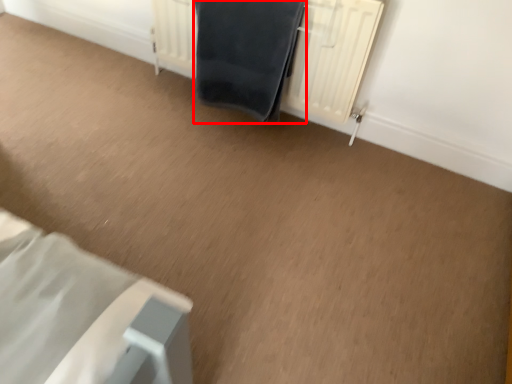
Question: Where is bath towel (annotated by the red box) located in relation to radiator in the image?

Choices:
 (A) right
 (B) left

Answer: (B)